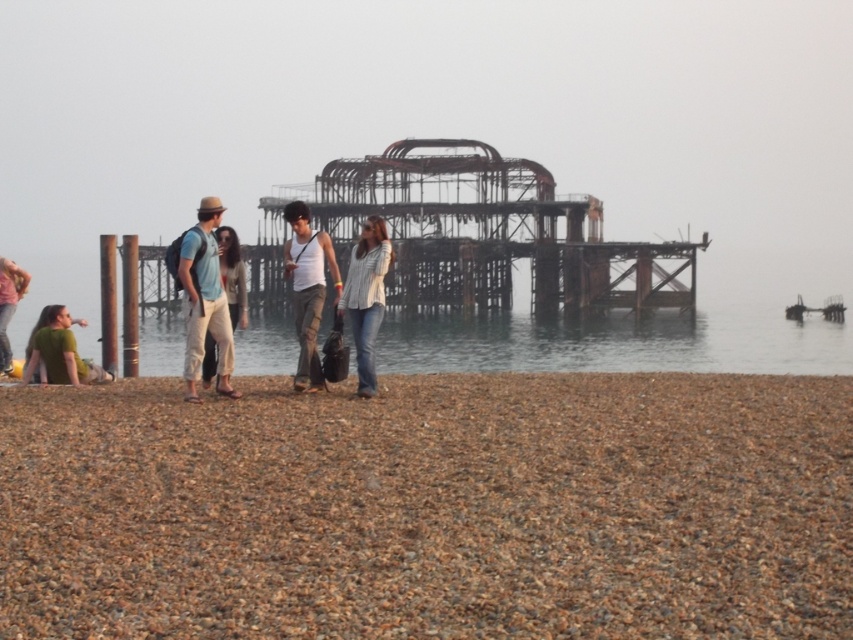
Can you confirm if clear water at center is wider than smooth wooden pole at left?

Yes.

Which is more to the left, clear water at center or smooth wooden pole at left?

Positioned to the left is smooth wooden pole at left.

Identify the location of clear water at center. pos(618,342).

Consider the image. Which is below, brown gravel at lower center or clear water at center?

brown gravel at lower center is below.

Does point (78, 592) lie in front of point (383, 356)?

Yes, point (78, 592) is closer to viewer.

The image size is (853, 640). In order to click on brown gravel at lower center in this screenshot , I will do `click(431, 508)`.

Between point (375, 272) and point (13, 308), which one is positioned in front?

Point (375, 272)

Locate an element on the screen. The image size is (853, 640). white cotton shirt at center is located at coordinates (366, 296).